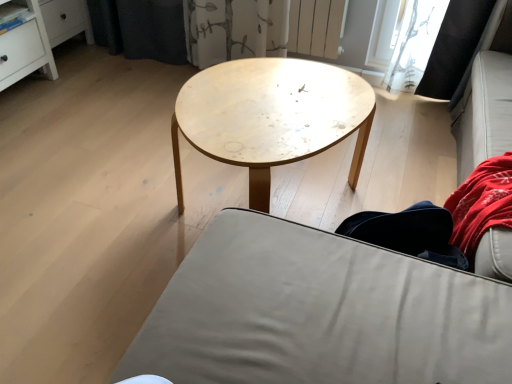
Question: Is matte gray fabric couch at center at the left side of denim pants at lower right?

Choices:
 (A) no
 (B) yes

Answer: (B)

Question: From a real-world perspective, does matte gray fabric couch at center stand above denim pants at lower right?

Choices:
 (A) yes
 (B) no

Answer: (A)

Question: Can you confirm if matte gray fabric couch at center is bigger than denim pants at lower right?

Choices:
 (A) yes
 (B) no

Answer: (A)

Question: Is matte gray fabric couch at center wider than denim pants at lower right?

Choices:
 (A) no
 (B) yes

Answer: (B)

Question: Can you confirm if matte gray fabric couch at center is taller than denim pants at lower right?

Choices:
 (A) yes
 (B) no

Answer: (A)

Question: Is the depth of matte gray fabric couch at center less than that of denim pants at lower right?

Choices:
 (A) no
 (B) yes

Answer: (B)

Question: From a real-world perspective, is natural wood coffee table at center located beneath denim pants at lower right?

Choices:
 (A) no
 (B) yes

Answer: (B)

Question: From the image's perspective, is natural wood coffee table at center located beneath denim pants at lower right?

Choices:
 (A) yes
 (B) no

Answer: (B)

Question: Could you tell me if natural wood coffee table at center is turned towards denim pants at lower right?

Choices:
 (A) no
 (B) yes

Answer: (A)

Question: Is natural wood coffee table at center positioned far away from denim pants at lower right?

Choices:
 (A) yes
 (B) no

Answer: (B)

Question: Is natural wood coffee table at center bigger than denim pants at lower right?

Choices:
 (A) no
 (B) yes

Answer: (B)

Question: Can you confirm if natural wood coffee table at center is taller than denim pants at lower right?

Choices:
 (A) no
 (B) yes

Answer: (B)

Question: From a real-world perspective, is denim pants at lower right physically above natural wood coffee table at center?

Choices:
 (A) no
 (B) yes

Answer: (B)